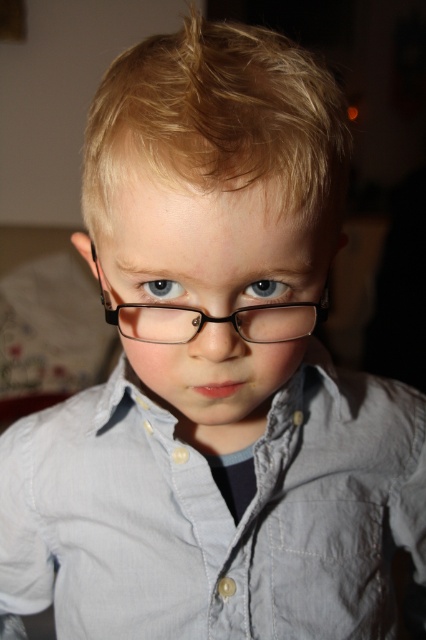
Is blue matte eye at center positioned at the back of blue glossy eye at center?

Yes, it is behind blue glossy eye at center.

Between blue matte eye at center and blue glossy eye at center, which one is positioned lower?

blue glossy eye at center is lower down.

Who is more forward, [258,285] or [146,284]?

Point [258,285]

Locate an element on the screen. The height and width of the screenshot is (640, 426). blue matte eye at center is located at coordinates (265, 289).

Is light blue cotton dress shirt at center wider than blue matte eye at center?

Indeed, light blue cotton dress shirt at center has a greater width compared to blue matte eye at center.

What do you see at coordinates (215, 515) in the screenshot?
I see `light blue cotton dress shirt at center` at bounding box center [215, 515].

The height and width of the screenshot is (640, 426). I want to click on light blue cotton dress shirt at center, so click(x=215, y=515).

Between light blue cotton dress shirt at center and blue glossy eye at center, which one is positioned lower?

light blue cotton dress shirt at center

Is point (34, 524) positioned before point (175, 289)?

That is False.

I want to click on light blue cotton dress shirt at center, so click(x=215, y=515).